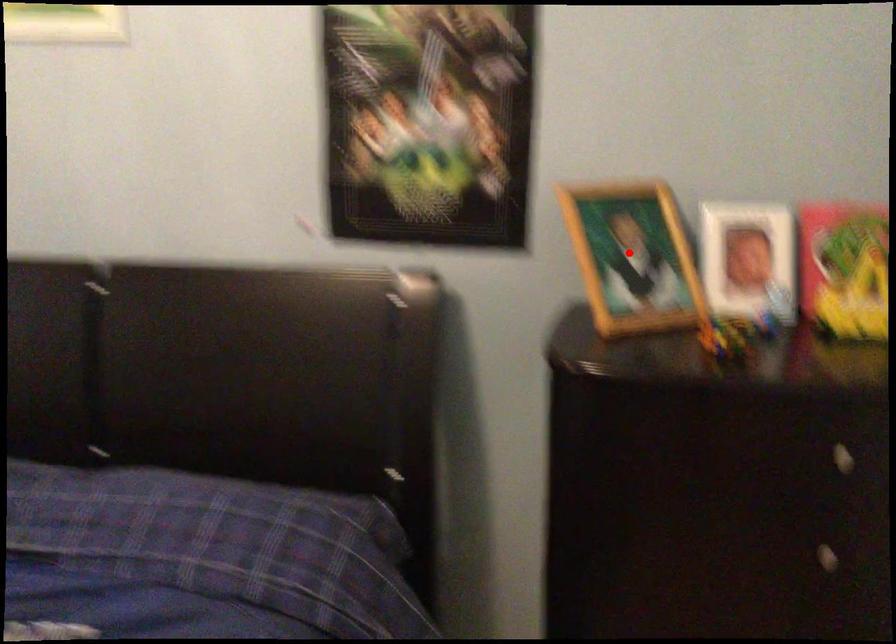
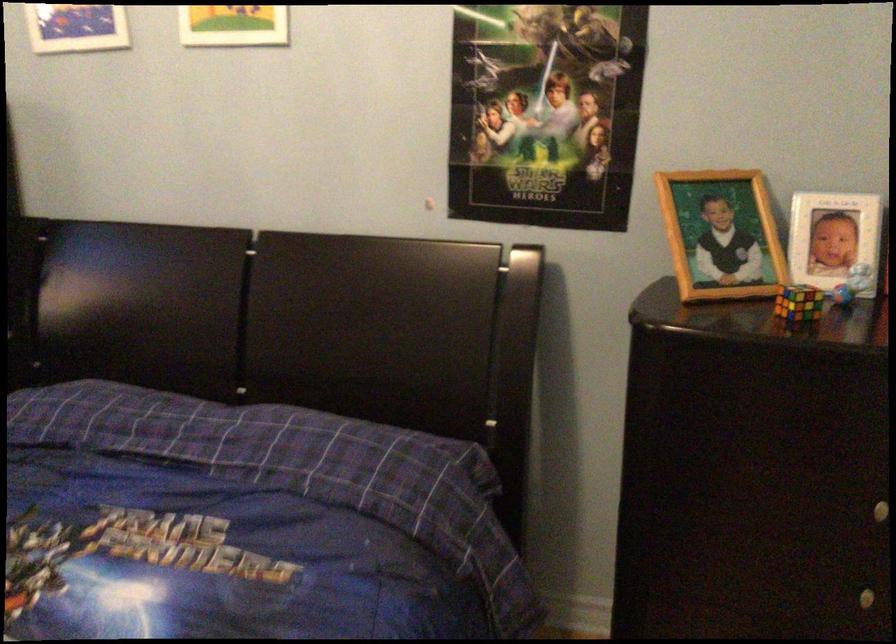
Locate, in the second image, the point that corresponds to the highlighted location in the first image.

(720, 234)